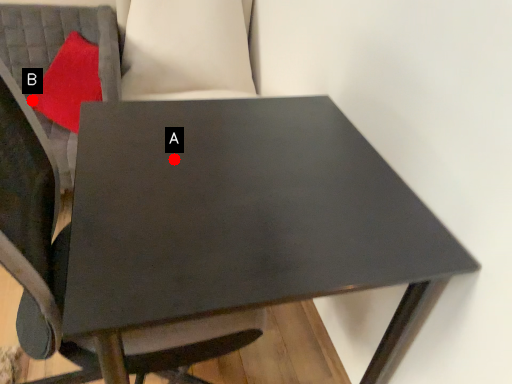
Question: Two points are circled on the image, labeled by A and B beside each circle. Among these points, which one is nearest to the camera?

Choices:
 (A) A is closer
 (B) B is closer

Answer: (A)